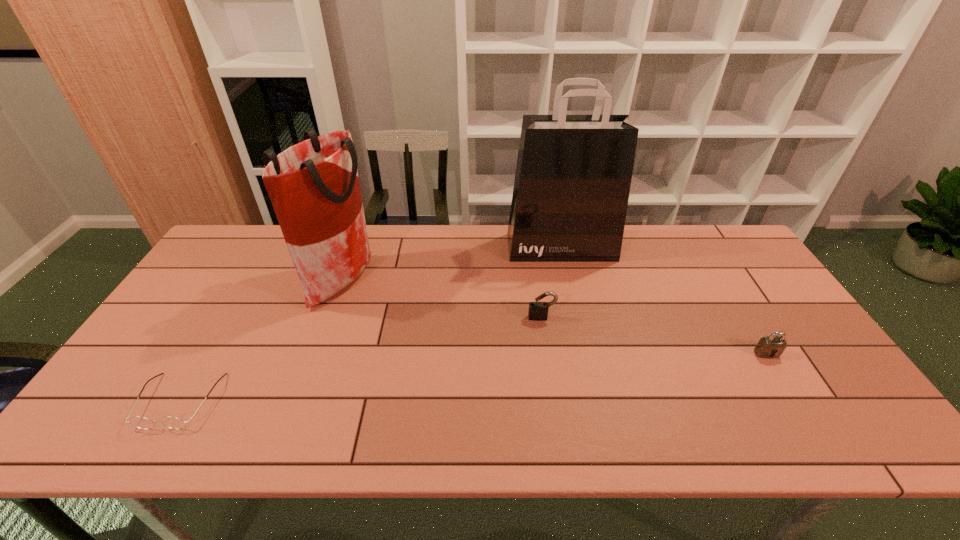
In the image, there is a desktop. Where is `vacant space at the near edge`? vacant space at the near edge is located at coordinates (665, 448).

You are a GUI agent. You are given a task and a screenshot of the screen. Output one action in this format:
    pyautogui.click(x=<x>, y=<y>)
    Task: Click on the vacant space at the left edge of the desktop
    The width and height of the screenshot is (960, 540).
    Given the screenshot: What is the action you would take?
    pyautogui.click(x=140, y=368)

Find the location of a particular element. free point at the far left corner is located at coordinates (248, 247).

Find the location of `vacant space at the far right corner`. vacant space at the far right corner is located at coordinates (723, 248).

The height and width of the screenshot is (540, 960). I want to click on blank region between the shopping bag and the farther padlock, so click(x=551, y=282).

Where is `free space that is in between the tallest object and the second object from left to right`? free space that is in between the tallest object and the second object from left to right is located at coordinates (452, 264).

Find the location of `unoccupied area between the nearer padlock and the fourth shortest object`. unoccupied area between the nearer padlock and the fourth shortest object is located at coordinates (555, 317).

Where is `empty space between the shortest object and the second object from left to right`? empty space between the shortest object and the second object from left to right is located at coordinates (261, 341).

Locate an element on the screen. vacant area between the leftmost object and the second shortest object is located at coordinates (473, 377).

What are the coordinates of `free space between the rightmost object and the third farthest object` in the screenshot? It's located at (654, 335).